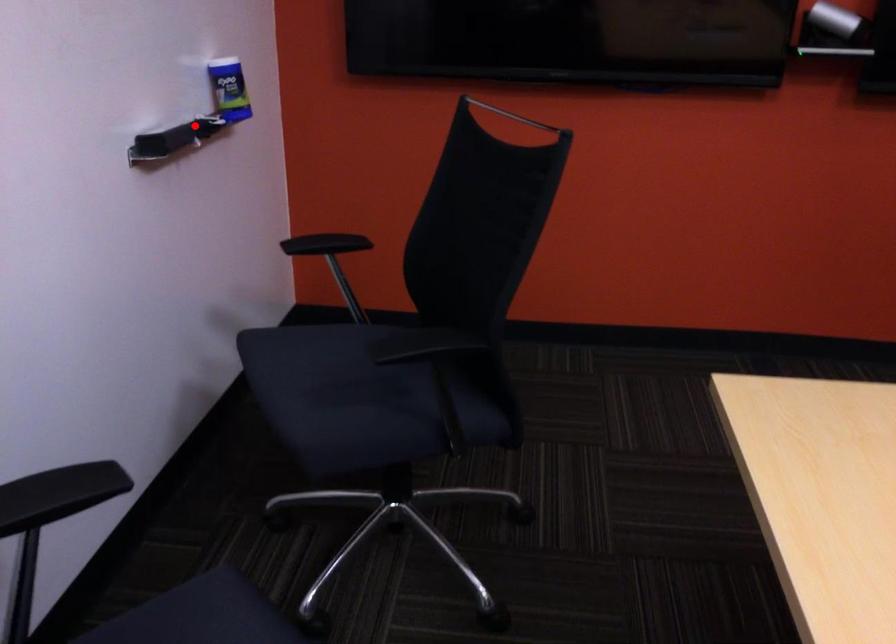
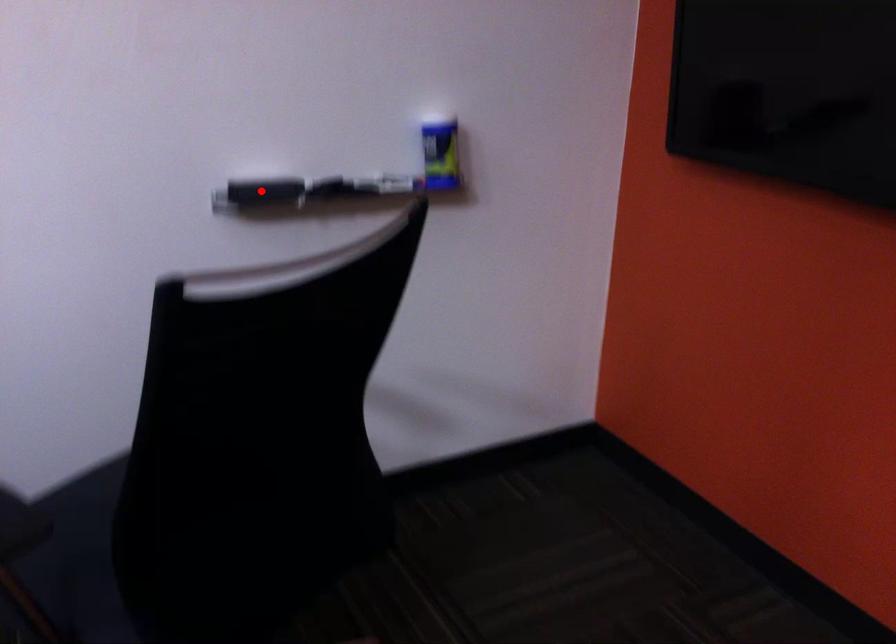
I am providing you with two images of the same scene from different viewpoints. A red point is marked on the first image and another point is marked on the second image. Is the marked point in image1 the same physical position as the marked point in image2?

No